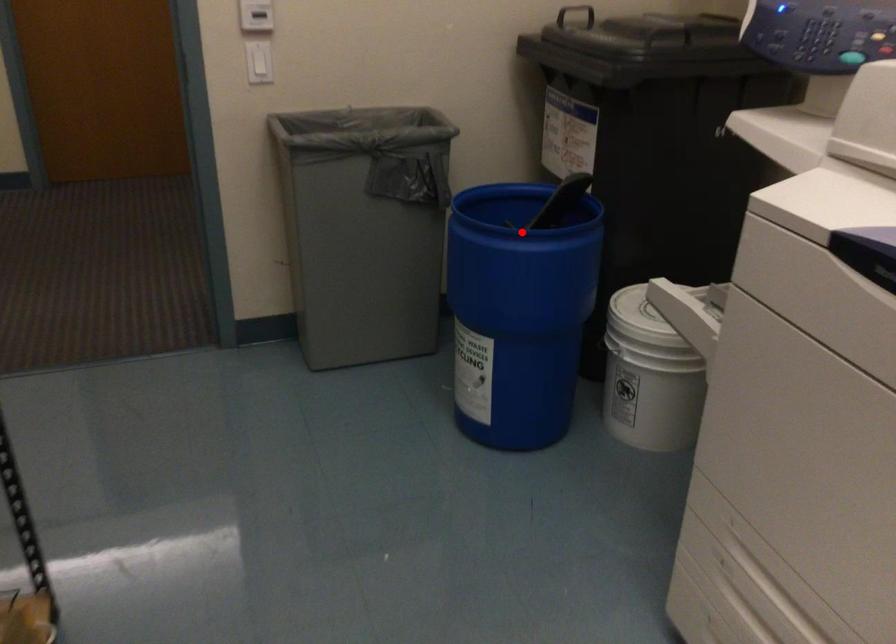
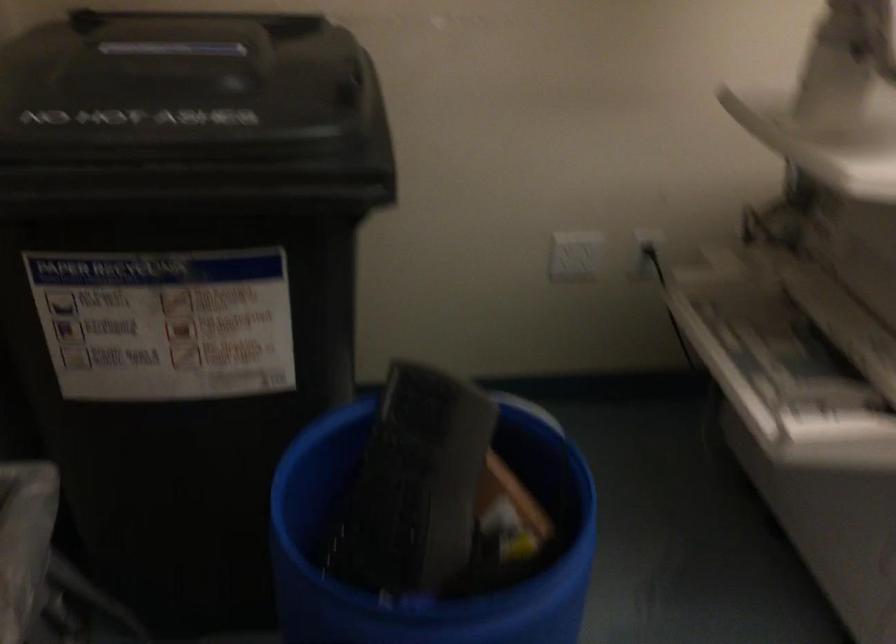
Find the pixel in the second image that matches the highlighted location in the first image.

(427, 542)